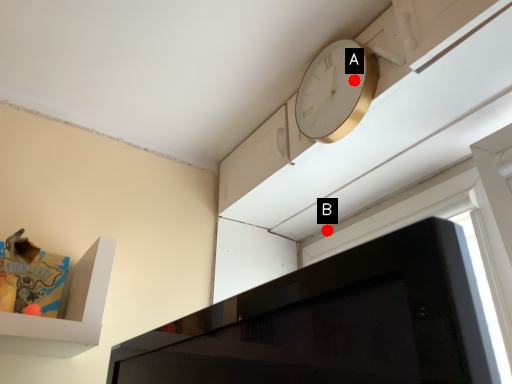
Question: Two points are circled on the image, labeled by A and B beside each circle. Which point is closer to the camera?

Choices:
 (A) A is closer
 (B) B is closer

Answer: (A)